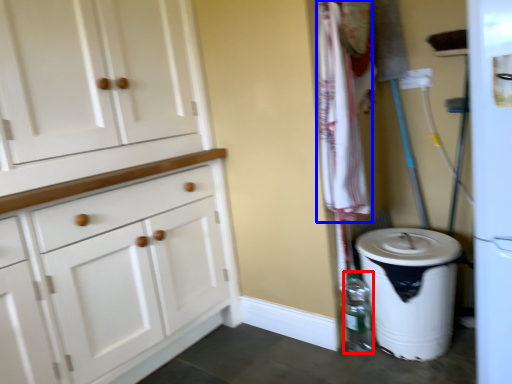
Question: Which object appears closest to the camera in this image, bottle (highlighted by a red box) or laundry (highlighted by a blue box)?

Choices:
 (A) bottle
 (B) laundry

Answer: (B)